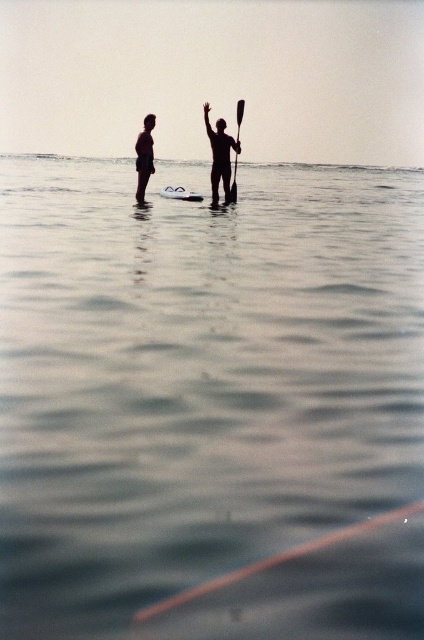
Question: Does black matte surfboard at center have a greater width compared to silhouette skin at left?

Choices:
 (A) yes
 (B) no

Answer: (A)

Question: Considering the relative positions of black matte surfboard at center and white foam surfboard at center in the image provided, where is black matte surfboard at center located with respect to white foam surfboard at center?

Choices:
 (A) right
 (B) left

Answer: (A)

Question: Can you confirm if silhouette skin at left is positioned below white foam surfboard at center?

Choices:
 (A) no
 (B) yes

Answer: (A)

Question: Which of these objects is positioned closest to the black matte paddleboard at center?

Choices:
 (A) silhouette skin at left
 (B) white foam surfboard at center
 (C) black matte surfboard at center
 (D) black plastic paddle at center

Answer: (C)

Question: Which object is farther from the camera taking this photo?

Choices:
 (A) silhouette skin at left
 (B) black matte paddleboard at center

Answer: (B)

Question: Which object is the closest to the silhouette skin at left?

Choices:
 (A) black plastic paddle at center
 (B) white foam surfboard at center

Answer: (B)